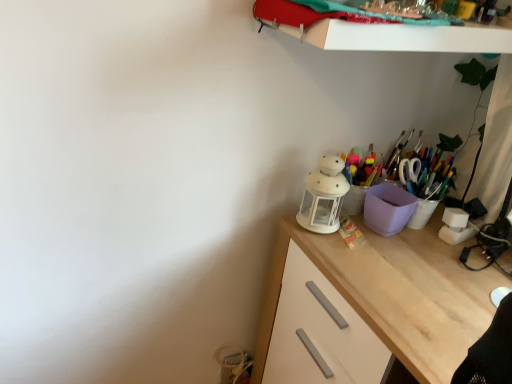
The image size is (512, 384). In order to click on free point above light wood desk at lower right (from a real-world perspective) in this screenshot , I will do `click(423, 262)`.